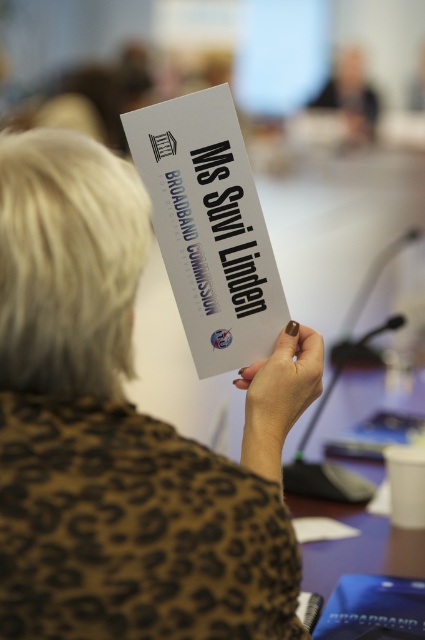
What do you see at coordinates (124, 432) in the screenshot? The width and height of the screenshot is (425, 640). I see `brown leopard print shirt at center` at bounding box center [124, 432].

Can you confirm if brown leopard print shirt at center is wider than purple matte table at lower right?

Correct, the width of brown leopard print shirt at center exceeds that of purple matte table at lower right.

Image resolution: width=425 pixels, height=640 pixels. I want to click on brown leopard print shirt at center, so click(124, 432).

Is point (118, 486) closer to camera compared to point (266, 458)?

That is True.

Does brown leopard print shirt at center appear on the right side of nail polish at center?

Incorrect, brown leopard print shirt at center is not on the right side of nail polish at center.

This screenshot has width=425, height=640. Describe the element at coordinates (124, 432) in the screenshot. I see `brown leopard print shirt at center` at that location.

Find the location of `brown leopard print shirt at center`. brown leopard print shirt at center is located at coordinates (124, 432).

Where is `white paper at center`? This screenshot has width=425, height=640. white paper at center is located at coordinates (209, 227).

Can you confirm if white paper at center is wider than purple matte table at lower right?

In fact, white paper at center might be narrower than purple matte table at lower right.

Where is `white paper at center`? This screenshot has width=425, height=640. white paper at center is located at coordinates (209, 227).

Where is `white paper at center`? This screenshot has width=425, height=640. white paper at center is located at coordinates (209, 227).